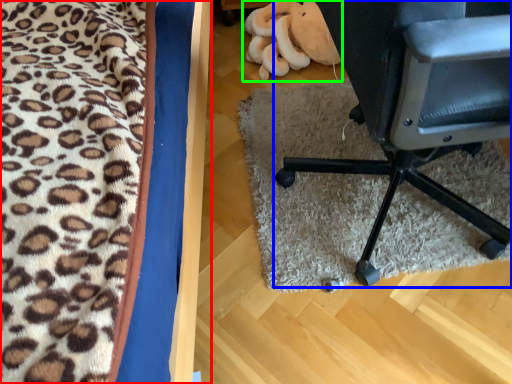
Question: Which object is the closest to the furniture (highlighted by a red box)? Choose among these: chair (highlighted by a blue box) or stuff (highlighted by a green box).

Choices:
 (A) chair
 (B) stuff

Answer: (A)